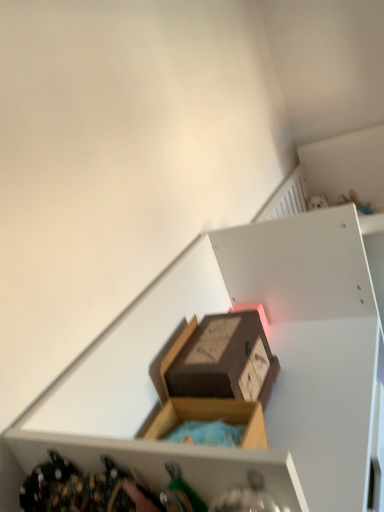
Question: Considering the positions of point (236, 355) and point (155, 397), is point (236, 355) closer or farther from the camera than point (155, 397)?

Choices:
 (A) farther
 (B) closer

Answer: (B)

Question: In the image, is matte brown box at center positioned in front of or behind wooden box at upper center?

Choices:
 (A) behind
 (B) front

Answer: (A)

Question: Is matte brown box at center wider or thinner than wooden box at upper center?

Choices:
 (A) wide
 (B) thin

Answer: (B)

Question: From the image's perspective, is wooden box at upper center positioned above or below matte brown box at center?

Choices:
 (A) below
 (B) above

Answer: (A)

Question: In terms of height, does wooden box at upper center look taller or shorter compared to matte brown box at center?

Choices:
 (A) tall
 (B) short

Answer: (A)

Question: Relative to matte brown box at center, is wooden box at upper center in front or behind?

Choices:
 (A) behind
 (B) front

Answer: (B)

Question: Considering the positions of point (273, 264) and point (261, 358), is point (273, 264) closer or farther from the camera than point (261, 358)?

Choices:
 (A) closer
 (B) farther

Answer: (B)